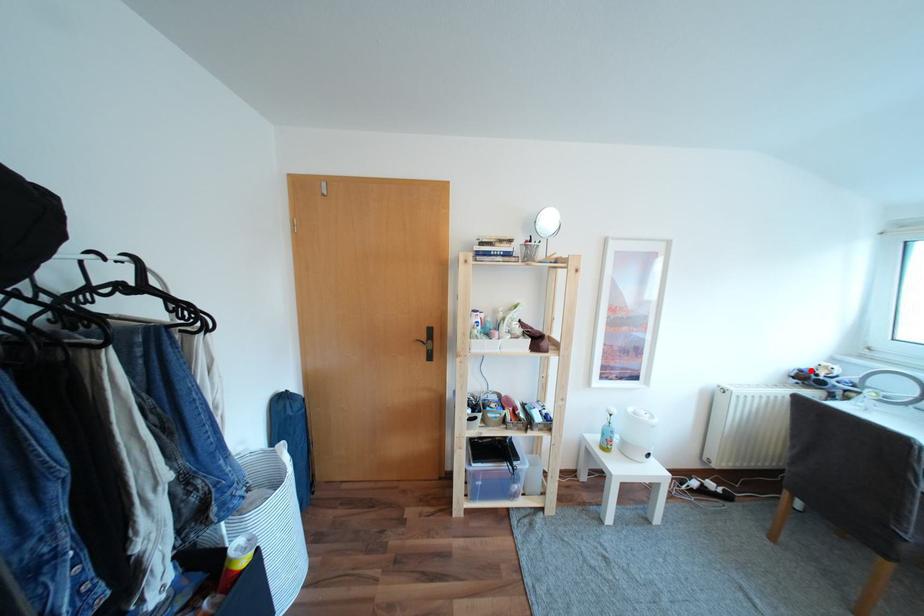
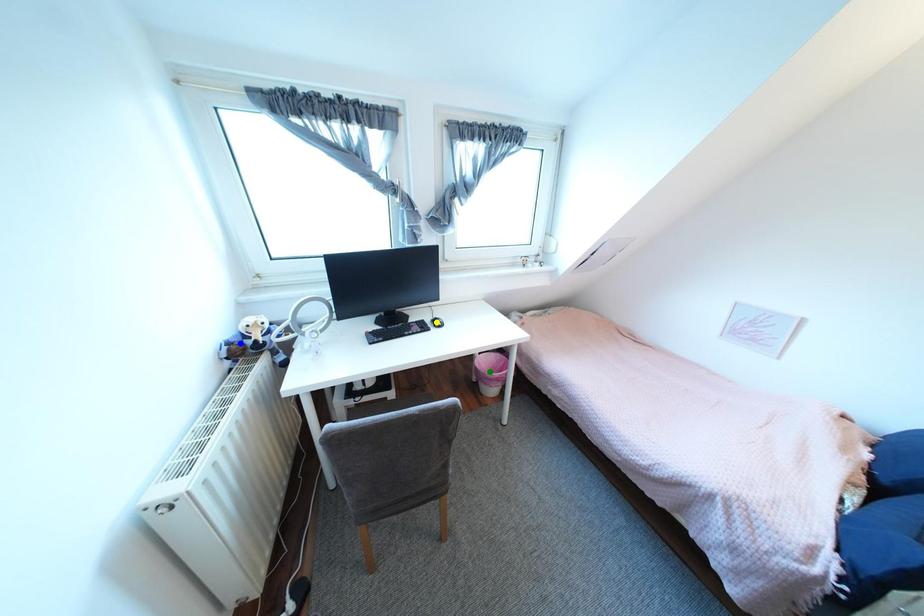
Question: I am providing you with two images of the same scene from different viewpoints. A red point is marked on the first image. You are given multiple points on the second image. Can you choose the point in image 2 that corresponds to the point in image 1?

Choices:
 (A) blue point
 (B) yellow point
 (C) green point

Answer: (A)